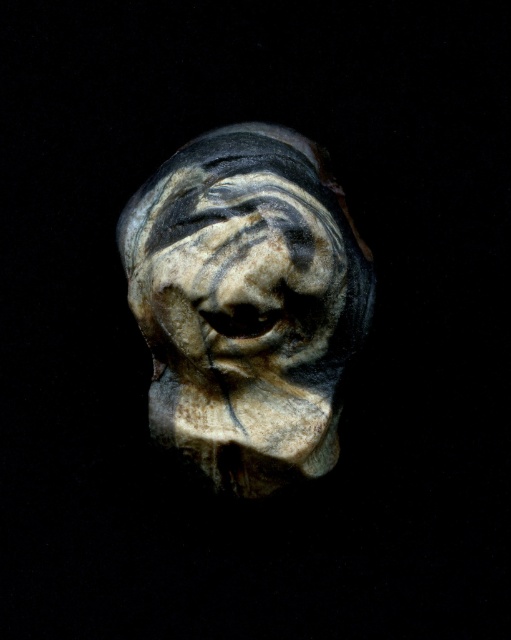
Is speckled stone head at center below speckled stone face at center?

Indeed, speckled stone head at center is positioned under speckled stone face at center.

Based on the photo, does speckled stone head at center lie behind speckled stone face at center?

No, it is in front of speckled stone face at center.

You are a GUI agent. You are given a task and a screenshot of the screen. Output one action in this format:
    pyautogui.click(x=<x>, y=<y>)
    Task: Click on the speckled stone head at center
    The image size is (511, 640).
    Given the screenshot: What is the action you would take?
    pyautogui.click(x=246, y=304)